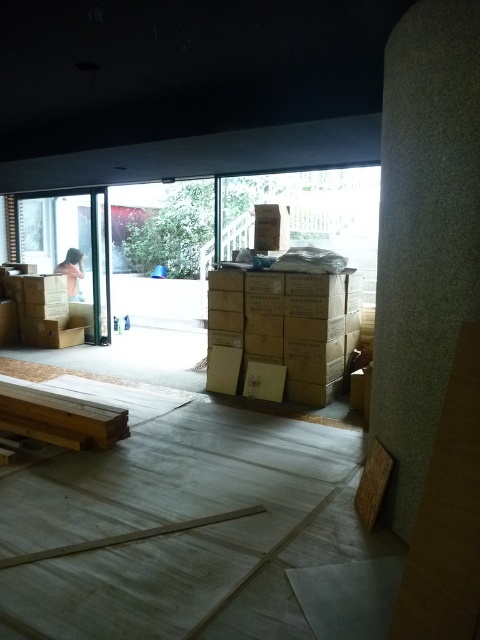
Question: Which of the following is the closest to the observer?

Choices:
 (A) (285, 228)
 (B) (73, 195)

Answer: (A)

Question: Can you confirm if transparent glass door at left is thinner than matte brown cardboard box at center?

Choices:
 (A) no
 (B) yes

Answer: (A)

Question: Is the position of transparent glass door at left less distant than that of matte brown cardboard box at center?

Choices:
 (A) yes
 (B) no

Answer: (B)

Question: Among these objects, which one is nearest to the camera?

Choices:
 (A) transparent glass door at left
 (B) matte brown cardboard box at center

Answer: (B)

Question: Can you confirm if transparent glass door at left is thinner than matte brown cardboard box at center?

Choices:
 (A) no
 (B) yes

Answer: (A)